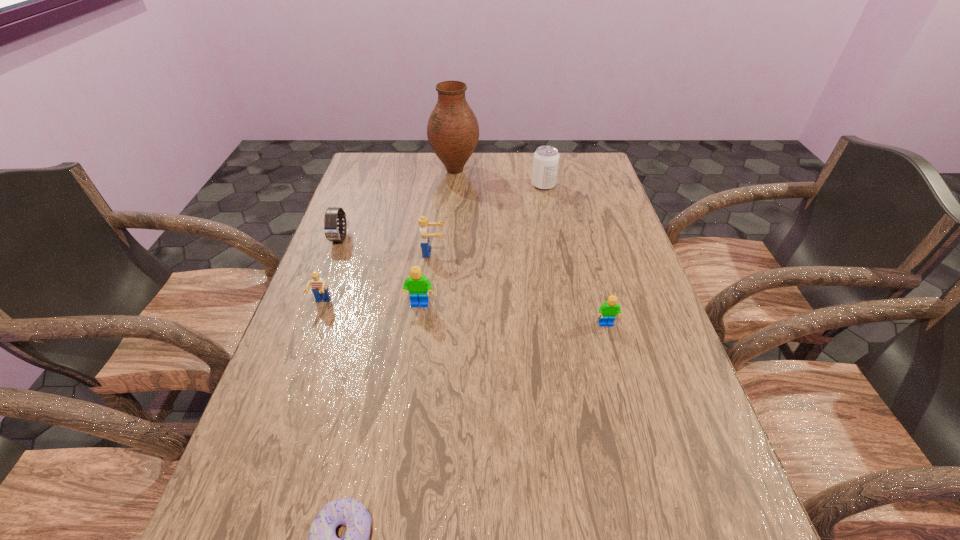
Where is `the second nearest object`? The width and height of the screenshot is (960, 540). the second nearest object is located at coordinates [x=607, y=311].

Where is `vacant region located on the right of the vase`? vacant region located on the right of the vase is located at coordinates (547, 170).

Where is `vacant space located 0.140m on the back of the seventh object from left to right`? The height and width of the screenshot is (540, 960). vacant space located 0.140m on the back of the seventh object from left to right is located at coordinates tap(539, 159).

Where is `blank space located on the face of the right blue Lego`? This screenshot has height=540, width=960. blank space located on the face of the right blue Lego is located at coordinates (541, 252).

At what (x,y) coordinates should I click in order to perform the action: click on vacant space located 0.170m on the face of the bigger green Lego. Please return your answer as a coordinate pair (x, y). Image resolution: width=960 pixels, height=540 pixels. Looking at the image, I should click on (411, 369).

Identify the location of blank area located 0.350m on the face of the watch. This screenshot has width=960, height=540. (299, 349).

Image resolution: width=960 pixels, height=540 pixels. What are the coordinates of `vacant space located 0.250m on the face of the leftmost Lego` in the screenshot? It's located at (286, 402).

The height and width of the screenshot is (540, 960). What are the coordinates of `free spot located 0.120m on the face of the rightmost object` in the screenshot? It's located at (619, 373).

Find the location of a particular element. This screenshot has height=540, width=960. vase present at the far edge is located at coordinates (452, 131).

Identify the location of soda can that is at the far edge. The width and height of the screenshot is (960, 540). (546, 158).